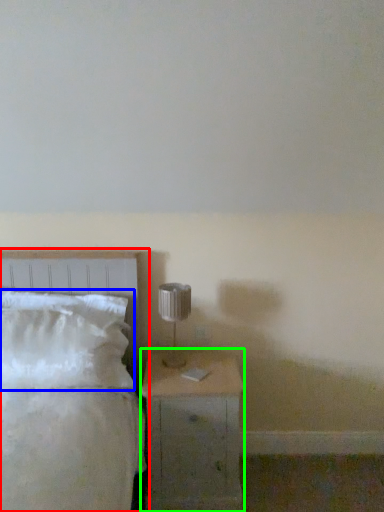
Question: Estimate the real-world distances between objects in this image. Which object is closer to bed (highlighted by a red box), pillow (highlighted by a blue box) or nightstand (highlighted by a green box)?

Choices:
 (A) pillow
 (B) nightstand

Answer: (A)